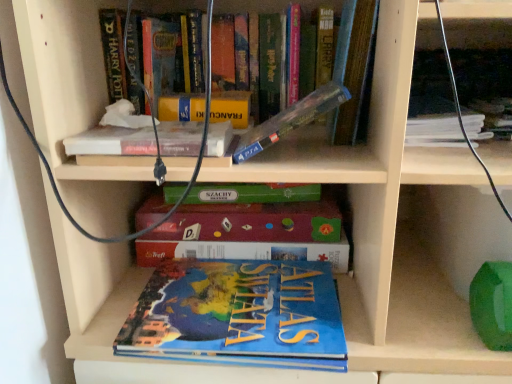
At what (x,y) coordinates should I click in order to perform the action: click on vacant area on top of blue matte atlas of the world at lower center, arranged as the 6th book when viewed from the top (from a real-world perspective). Please return your answer as a coordinate pair (x, y). Looking at the image, I should click on (236, 295).